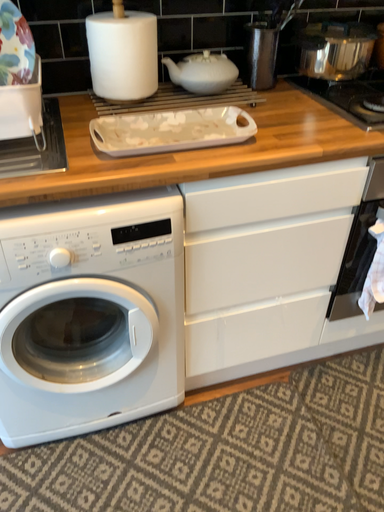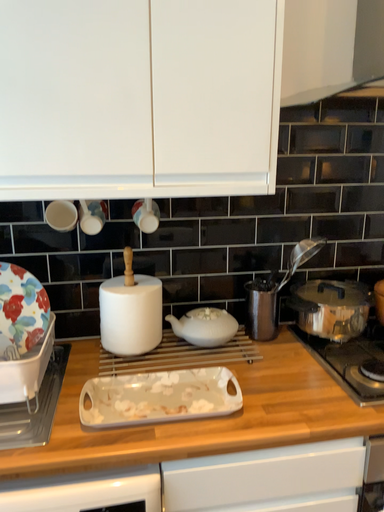
Question: How did the camera likely rotate when shooting the video?

Choices:
 (A) rotated downward
 (B) rotated upward

Answer: (B)